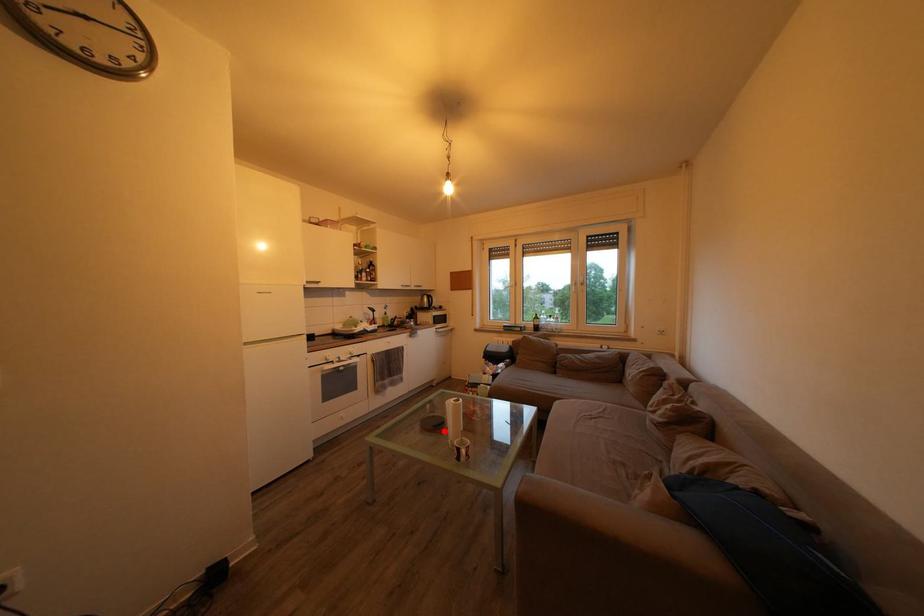
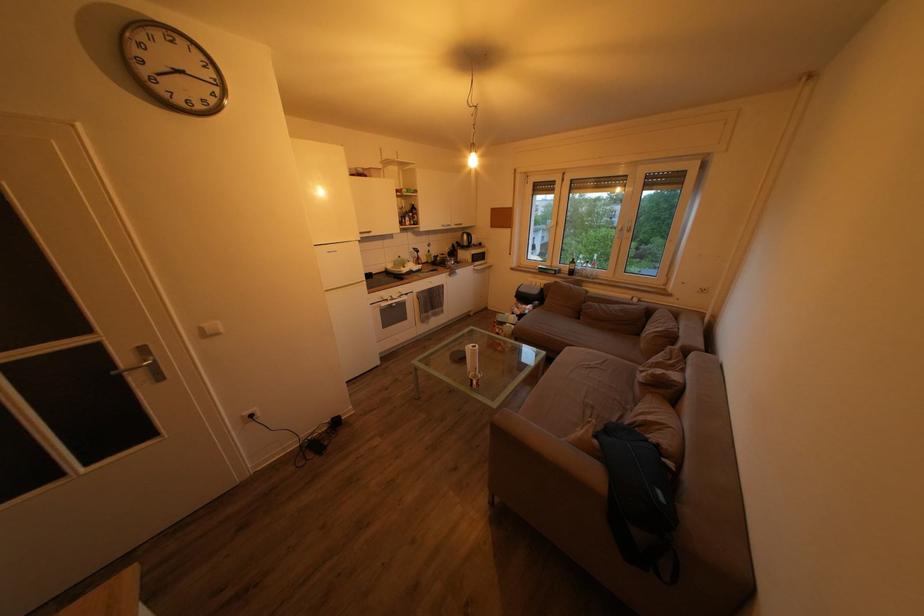
Locate, in the second image, the point that corresponds to the highlighted location in the first image.

(468, 365)